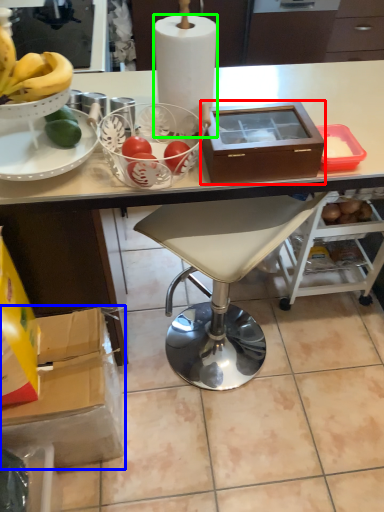
Question: Which is nearer to the box (highlighted by a red box)? cardboard box (highlighted by a blue box) or paper towel (highlighted by a green box).

Choices:
 (A) cardboard box
 (B) paper towel

Answer: (B)